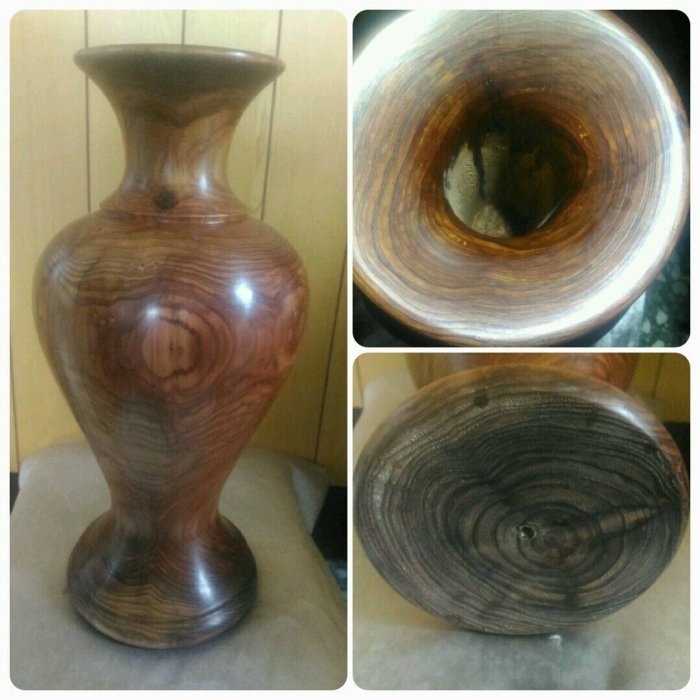
Where is `table`? Image resolution: width=700 pixels, height=700 pixels. table is located at coordinates (278, 624), (480, 656).